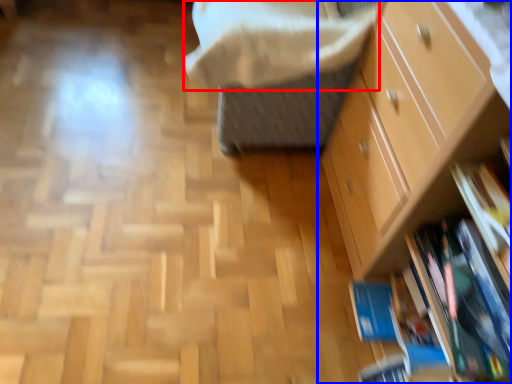
Question: Among these objects, which one is farthest to the camera, blanket (highlighted by a red box) or chest of drawers (highlighted by a blue box)?

Choices:
 (A) blanket
 (B) chest of drawers

Answer: (A)